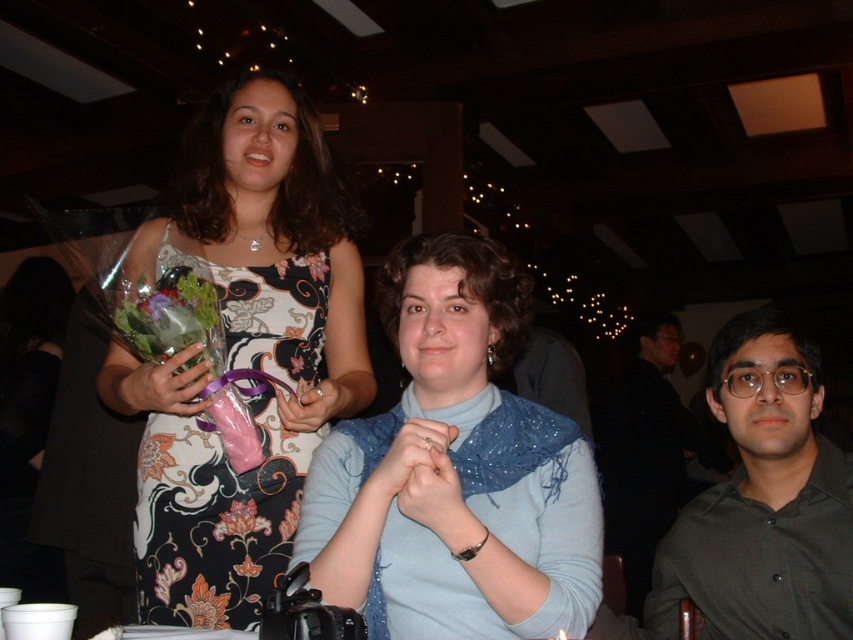
Question: Does blue fabric scarf at center lie behind orange matte flower at center?

Choices:
 (A) no
 (B) yes

Answer: (A)

Question: Which point appears farthest from the camera in this image?

Choices:
 (A) (180, 564)
 (B) (207, 605)

Answer: (A)

Question: Where is floral-patterned dress at upper left located in relation to green shirt at right in the image?

Choices:
 (A) above
 (B) below

Answer: (A)

Question: Can you confirm if blue fabric scarf at center is positioned above floral-patterned bouquet at upper left?

Choices:
 (A) yes
 (B) no

Answer: (A)

Question: Which of the following is the closest to the observer?

Choices:
 (A) (285, 524)
 (B) (149, 476)

Answer: (B)

Question: Which point is farther to the camera?

Choices:
 (A) (805, 524)
 (B) (614, 465)

Answer: (B)